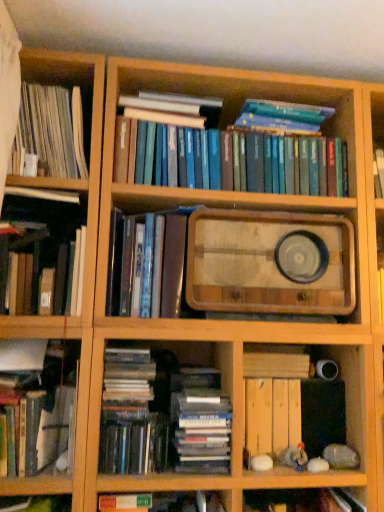
Question: Based on their positions, is wooden planks at lower right located to the left or right of shiny black book at lower left, the first book ordered from the bottom?

Choices:
 (A) right
 (B) left

Answer: (A)

Question: In terms of width, does wooden planks at lower right look wider or thinner when compared to shiny black book at lower left, the seventh book positioned from the top?

Choices:
 (A) thin
 (B) wide

Answer: (A)

Question: Considering the real-world distances, which object is closest to the hardcover book at lower left, which is counted as the sixth book, starting from the top?

Choices:
 (A) wooden tray at center
 (B) blue hardcover book at upper center, marked as the 6th book in a bottom-to-top arrangement
 (C) shiny black book at lower left, the first book ordered from the bottom
 (D) wooden planks at lower right
 (E) shiny metallic book at center, the fourth book when ordered from bottom to top

Answer: (C)

Question: Which is farther from the hardcover books at center, the 5th book from the top?

Choices:
 (A) blue hardcover book at upper center, acting as the second book starting from the top
 (B) wooden planks at lower right
 (C) white paperbacks at left, which is the 1th book in top-to-bottom order
 (D) wooden tray at center
 (E) shiny black book at lower left, the seventh book positioned from the top

Answer: (C)